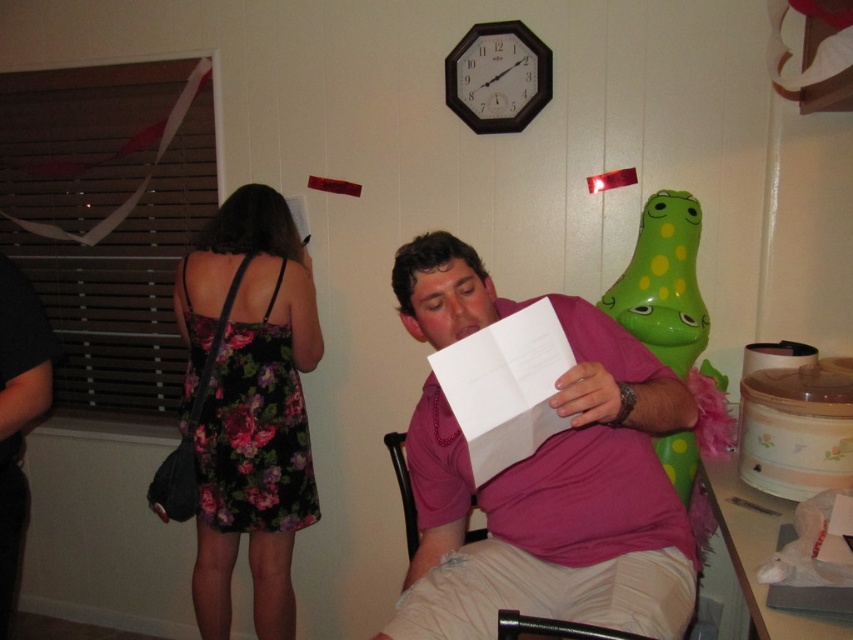
You are standing at the point labeled as point (553,628) in the image. What object are you sitting on?

The point (553,628) indicates the metallic black chair at lower center, so you are sitting on the metallic black chair at lower center.

You are a photographer setting up for a portrait shoot in this room. You need to position a light source between the floral dress at left and the metallic black chair at lower center. Which object should the light be placed closer to if you want to highlight the taller one?

The light source should be placed closer to the floral dress at left because it is much taller than the metallic black chair at lower center, so positioning the light closer to it will better highlight its height.

You are a photographer trying to capture a clear shot of the black plastic clock at upper center. However, the floral dress at left is blocking your view. Can you move the dress to get an unobstructed view of the clock?

The floral dress at left is in front of the black plastic clock at upper center, so moving the dress would allow you to see the clock without obstruction.